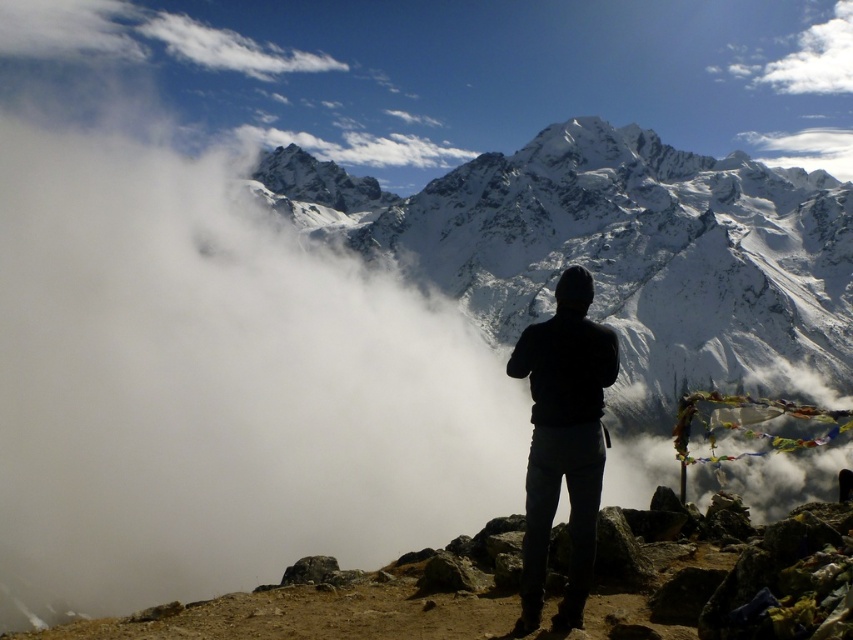
You are a hiker who wants to take a photo of the snowy granite mountain at upper center and the white fluffy cloud at upper right. Based on their positions, which object should you focus on first to ensure both are in the frame?

The snowy granite mountain at upper center is below the white fluffy cloud at upper right, so you should focus on the snowy granite mountain at upper center first to ensure both are in the frame.

Based on the photo, you are a photographer trying to capture the silhouette of the person wearing the black matte jacket at center against the white fluffy cloud at upper center. Based on their sizes, will the jacket silhouette be bigger or smaller than the cloud in the photo?

The black matte jacket at center is larger in size than the white fluffy cloud at upper center, so the jacket silhouette will be bigger than the cloud in the photo.

You are a hiker who wants to take a photo of the white fluffy cloud at upper right while standing near the black matte jacket at center. Which direction should you face to capture the cloud in your shot?

The black matte jacket at center is positioned on the left side of white fluffy cloud at upper right, so you should face towards the right to capture the white fluffy cloud at upper right in your photo.